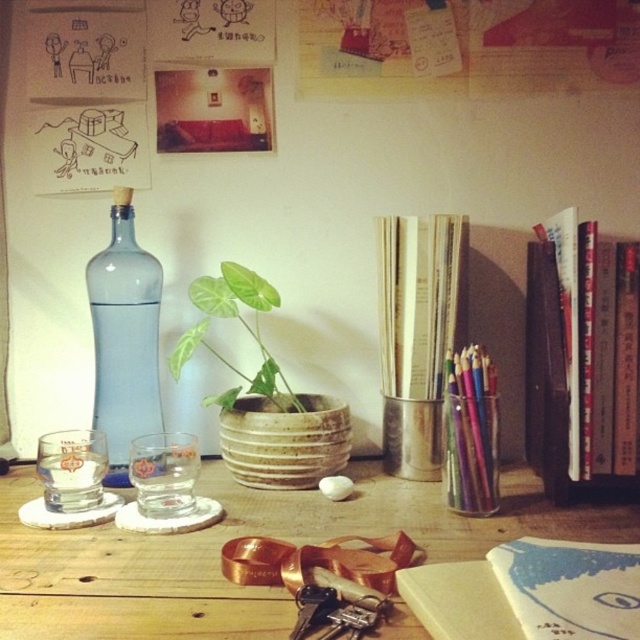
You are standing at the edge of the desk and want to place a new item exactly at the point labeled as point (244, 534). What is the object located at that point?

The point (244, 534) corresponds to the wooden table at center.

You are organizing your desk and want to place a new item between the hardcover books at right and the metallic glass pencil holder at center right. Considering their heights, which object should you place the item closer to to ensure stability?

Since the hardcover books at right are taller than the metallic glass pencil holder at center right, placing the item closer to the hardcover books at right would provide better stability due to their greater height.

You are organizing items on your desk and need to place a new item that requires more vertical space. Which object between the transparent glass bottle at left and the metallic glass pencil holder at center right should you move to accommodate the item?

The transparent glass bottle at left is taller than the metallic glass pencil holder at center right, so you should move the transparent glass bottle at left to make space for the new item that needs more vertical space.